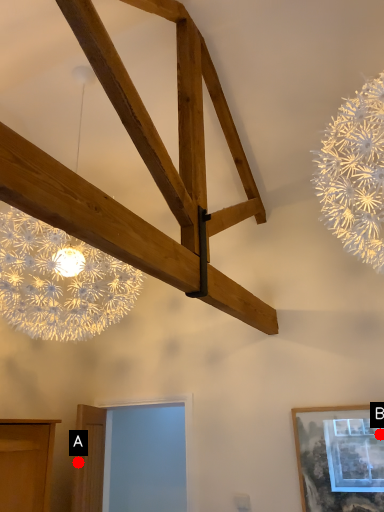
Question: Two points are circled on the image, labeled by A and B beside each circle. Which point is closer to the camera?

Choices:
 (A) A is closer
 (B) B is closer

Answer: (B)